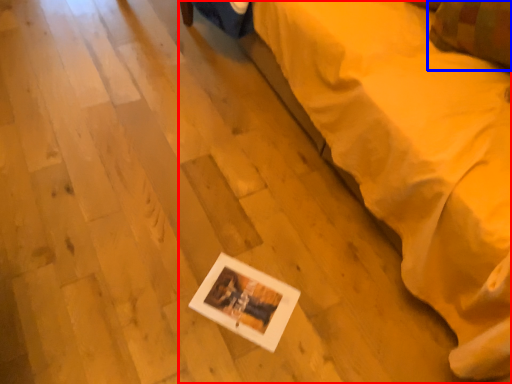
Question: Among these objects, which one is nearest to the camera, furniture (highlighted by a red box) or pillow (highlighted by a blue box)?

Choices:
 (A) furniture
 (B) pillow

Answer: (A)